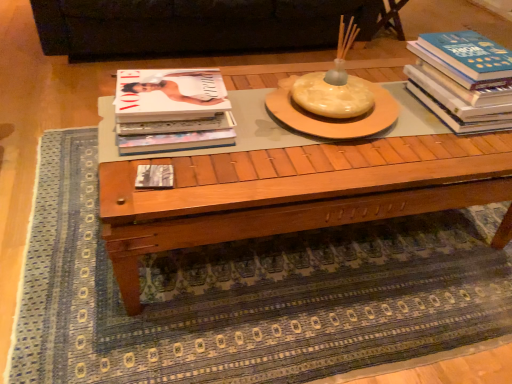
Where is `free space in front of matte white magazine at left, which appears as the 2th book when viewed from the right`? Image resolution: width=512 pixels, height=384 pixels. free space in front of matte white magazine at left, which appears as the 2th book when viewed from the right is located at coordinates pos(173,178).